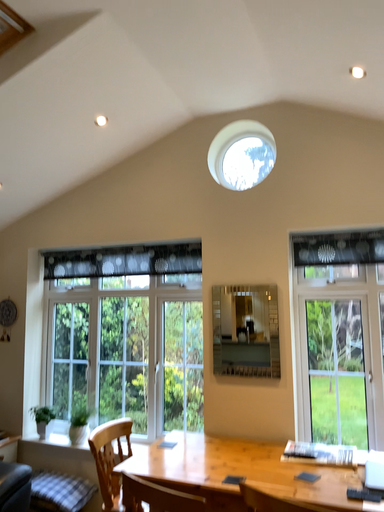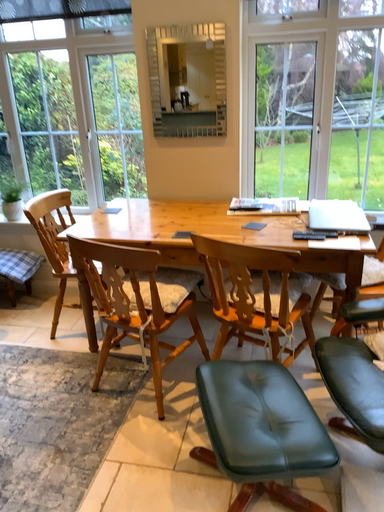
Question: How did the camera likely rotate when shooting the video?

Choices:
 (A) rotated right
 (B) rotated left

Answer: (A)